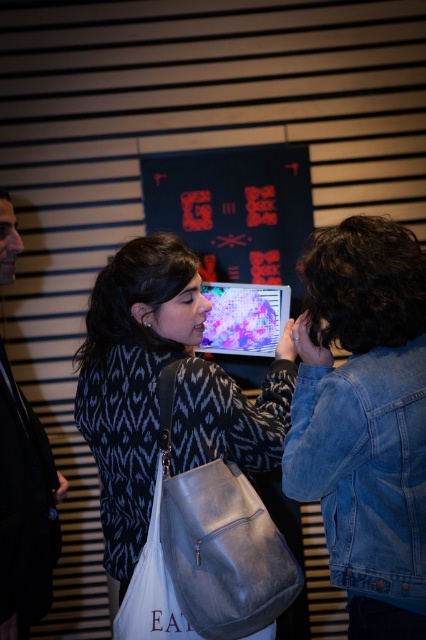
Which is below, matte black sweater at center or black leather jacket at left?

black leather jacket at left

Identify the location of matte black sweater at center. (127, 387).

Is point (103, 380) behind point (11, 627)?

No.

Locate an element on the screen. This screenshot has height=640, width=426. matte black sweater at center is located at coordinates (127, 387).

Which of these two, matte black sweater at center or leather bag at center, stands shorter?

leather bag at center

Is point (135, 497) behind point (236, 529)?

Yes.

Find the location of `matte black sweater at center`. matte black sweater at center is located at coordinates (127, 387).

Is matte black sweater at center taller than denim jacket at lower right?

Indeed, matte black sweater at center has a greater height compared to denim jacket at lower right.

Between matte black sweater at center and denim jacket at lower right, which one is positioned higher?

matte black sweater at center is higher up.

Between point (127, 422) and point (354, 360), which one is positioned behind?

Positioned behind is point (127, 422).

Where is `matte black sweater at center`? Image resolution: width=426 pixels, height=640 pixels. matte black sweater at center is located at coordinates (127, 387).